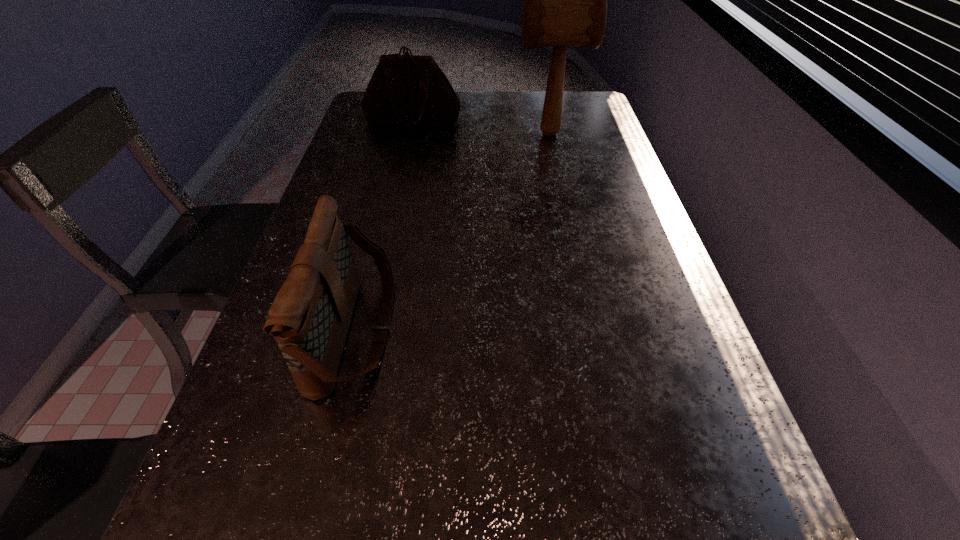
You are a GUI agent. You are given a task and a screenshot of the screen. Output one action in this format:
    pyautogui.click(x=<x>, y=<y>)
    Task: Click on the object that is at the right edge
    
    Given the screenshot: What is the action you would take?
    pyautogui.click(x=565, y=0)

Find the location of a particular element. object located in the far left corner section of the desktop is located at coordinates (410, 90).

I want to click on vacant space at the far edge of the desktop, so (499, 99).

What are the coordinates of `free spot at the left edge of the desktop` in the screenshot? It's located at click(377, 145).

Image resolution: width=960 pixels, height=540 pixels. I want to click on vacant space at the right edge of the desktop, so click(x=656, y=286).

Find the location of a particular element. The width and height of the screenshot is (960, 540). free space between the nearest object and the farther shoulder bag is located at coordinates (384, 225).

You are a GUI agent. You are given a task and a screenshot of the screen. Output one action in this format:
    pyautogui.click(x=<x>, y=<y>)
    Task: Click on the empty space that is in between the rightmost object and the nearest object
    The height and width of the screenshot is (540, 960).
    Given the screenshot: What is the action you would take?
    pyautogui.click(x=452, y=232)

The image size is (960, 540). I want to click on vacant point located between the rightmost object and the farther shoulder bag, so click(x=481, y=127).

The height and width of the screenshot is (540, 960). I want to click on free space between the tallest object and the nearer shoulder bag, so click(x=452, y=232).

At what (x,y) coordinates should I click in order to perform the action: click on vacant region between the nearest object and the farther shoulder bag. Please return your answer as a coordinate pair (x, y). Looking at the image, I should click on (384, 225).